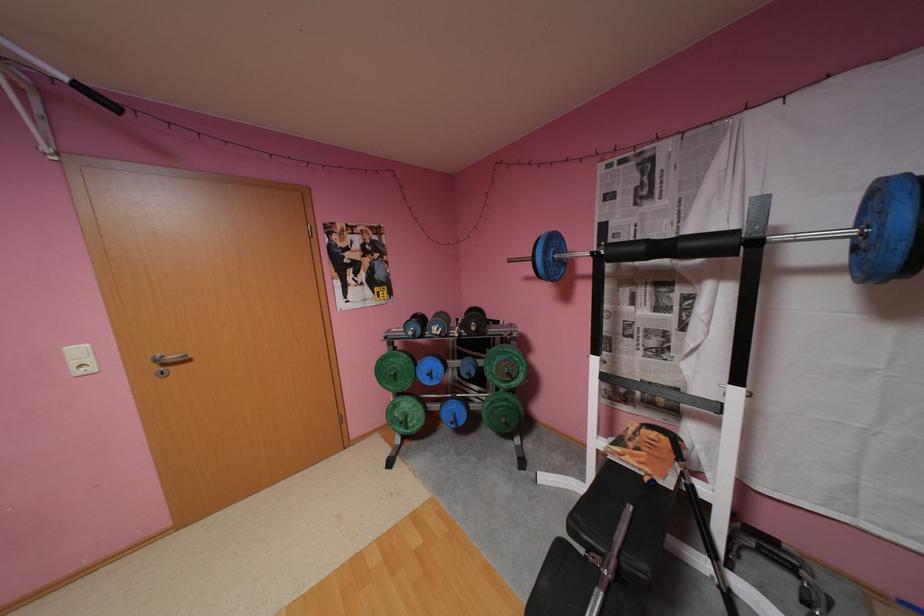
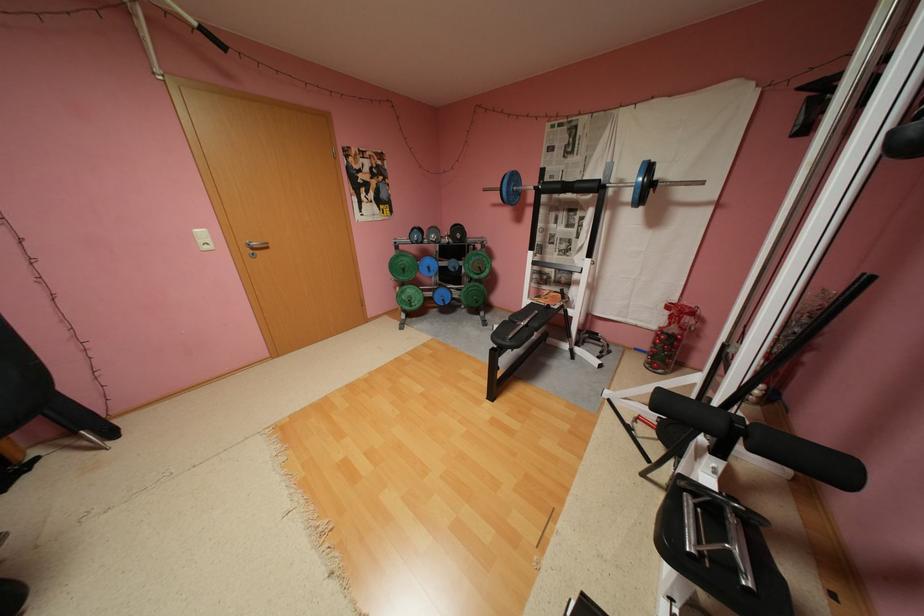
Locate, in the second image, the point that corresponds to pixel 82 363 in the first image.

(210, 241)